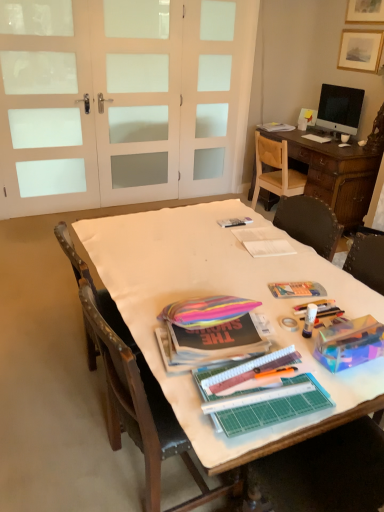
Where is `vacant space to the right of rainbow fabric bag at center, which is counted as the third magazine, starting from the back`? vacant space to the right of rainbow fabric bag at center, which is counted as the third magazine, starting from the back is located at coordinates (294, 320).